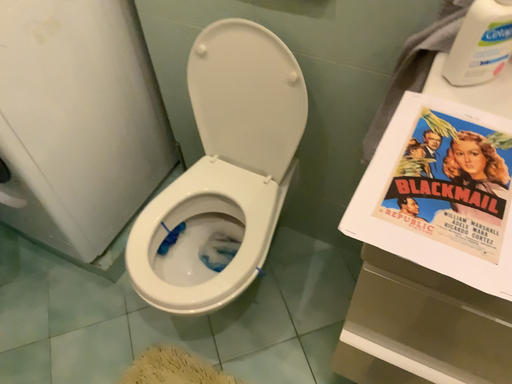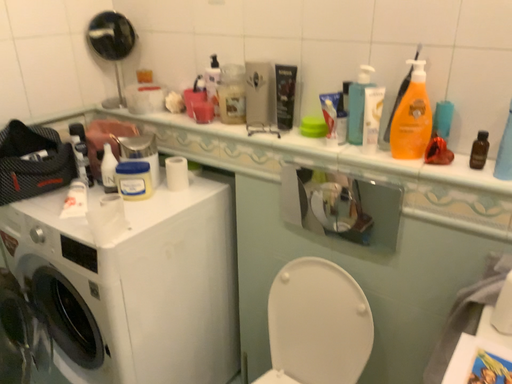
Question: Which way did the camera rotate in the video?

Choices:
 (A) rotated upward
 (B) rotated downward

Answer: (A)